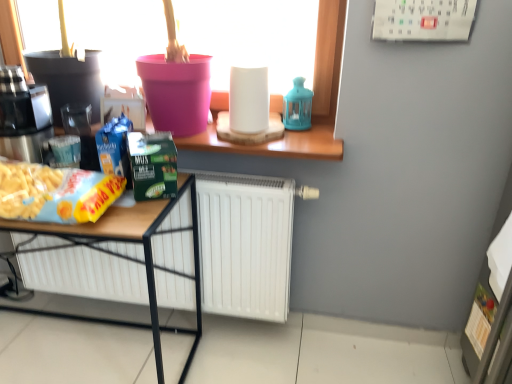
Question: From a real-world perspective, is wooden desk at lower left below yellow matte snack packet at lower left?

Choices:
 (A) yes
 (B) no

Answer: (A)

Question: Is wooden desk at lower left at the right side of yellow matte snack packet at lower left?

Choices:
 (A) yes
 (B) no

Answer: (B)

Question: Is wooden desk at lower left thinner than yellow matte snack packet at lower left?

Choices:
 (A) no
 (B) yes

Answer: (A)

Question: Is wooden desk at lower left behind yellow matte snack packet at lower left?

Choices:
 (A) yes
 (B) no

Answer: (A)

Question: Would you say wooden desk at lower left is a long distance from yellow matte snack packet at lower left?

Choices:
 (A) no
 (B) yes

Answer: (A)

Question: From their relative heights in the image, would you say pink plastic bucket at upper center is taller or shorter than brushed metal coffee machine at left?

Choices:
 (A) tall
 (B) short

Answer: (A)

Question: Based on their sizes in the image, would you say pink plastic bucket at upper center is bigger or smaller than brushed metal coffee machine at left?

Choices:
 (A) big
 (B) small

Answer: (A)

Question: Considering their positions, is pink plastic bucket at upper center located in front of or behind brushed metal coffee machine at left?

Choices:
 (A) front
 (B) behind

Answer: (A)

Question: Considering the relative positions of pink plastic bucket at upper center and brushed metal coffee machine at left in the image provided, is pink plastic bucket at upper center to the left or to the right of brushed metal coffee machine at left?

Choices:
 (A) right
 (B) left

Answer: (A)

Question: Is wooden desk at lower left in front of or behind brushed metal coffee machine at left in the image?

Choices:
 (A) behind
 (B) front

Answer: (B)

Question: Is wooden desk at lower left inside or outside of brushed metal coffee machine at left?

Choices:
 (A) inside
 (B) outside

Answer: (B)

Question: From a real-world perspective, relative to brushed metal coffee machine at left, is wooden desk at lower left vertically above or below?

Choices:
 (A) above
 (B) below

Answer: (B)

Question: Does point (23, 309) appear closer or farther from the camera than point (10, 147)?

Choices:
 (A) closer
 (B) farther

Answer: (B)

Question: In terms of width, does yellow matte snack packet at lower left look wider or thinner when compared to brushed metal coffee machine at left?

Choices:
 (A) wide
 (B) thin

Answer: (B)

Question: From a real-world perspective, is yellow matte snack packet at lower left above or below brushed metal coffee machine at left?

Choices:
 (A) below
 (B) above

Answer: (A)